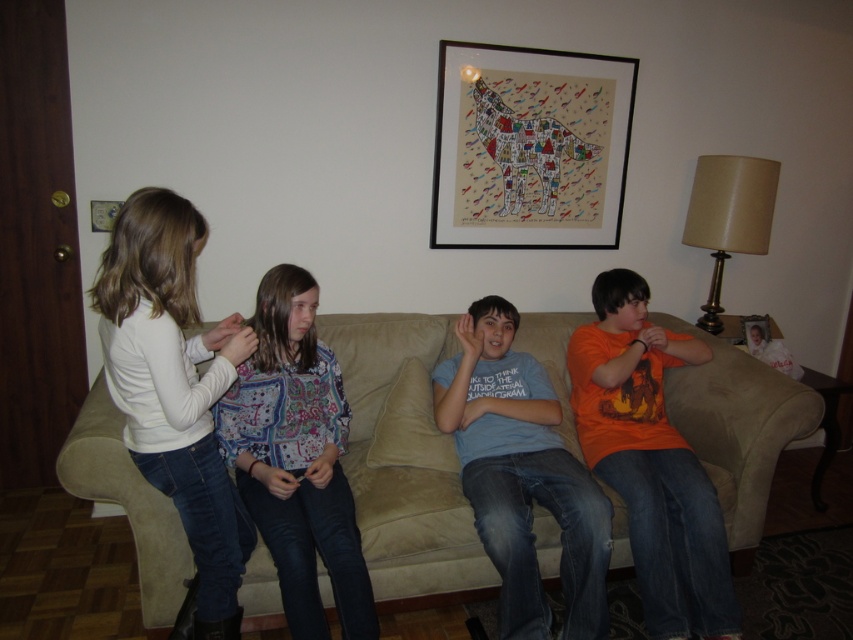
Can you confirm if suede couch at center is positioned above white soft shirt at left?

No.

Can you confirm if suede couch at center is thinner than white soft shirt at left?

No.

Between point (567, 317) and point (120, 307), which one is positioned behind?

Point (567, 317)

Where is `suede couch at center`? suede couch at center is located at coordinates (402, 467).

Which is below, wooden framed artwork at upper center or patterned fabric shirt at center?

patterned fabric shirt at center

Locate an element on the screen. wooden framed artwork at upper center is located at coordinates (529, 147).

Locate an element on the screen. The height and width of the screenshot is (640, 853). suede couch at center is located at coordinates (402, 467).

You are a GUI agent. You are given a task and a screenshot of the screen. Output one action in this format:
    pyautogui.click(x=<x>, y=<y>)
    Task: Click on the suede couch at center
    This screenshot has height=640, width=853.
    Given the screenshot: What is the action you would take?
    pyautogui.click(x=402, y=467)